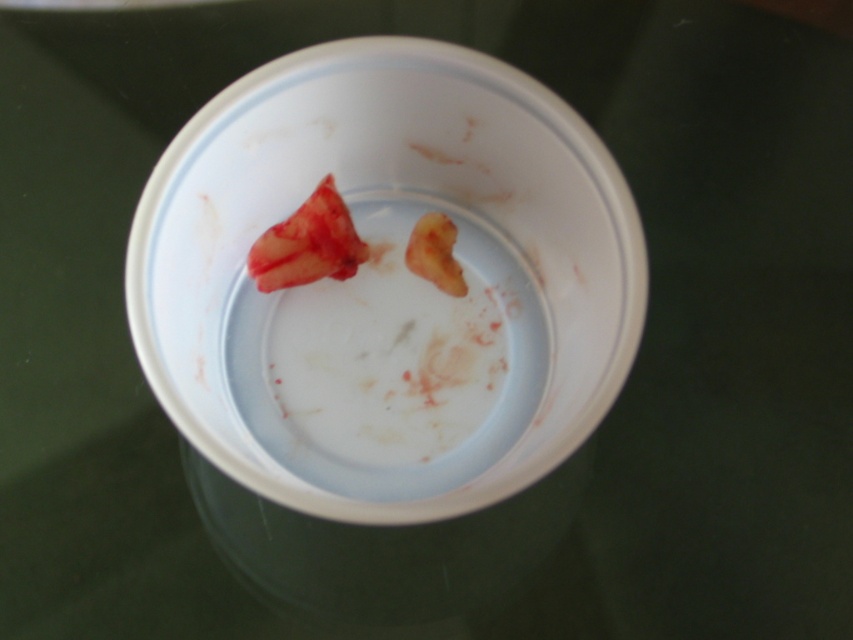
Is white glossy plate at center above meaty red at center?

Actually, white glossy plate at center is below meaty red at center.

Is white glossy plate at center further to the viewer compared to meaty red at center?

No, it is in front of meaty red at center.

Is point (476, 56) more distant than point (271, 282)?

No, it is not.

Locate an element on the screen. white glossy plate at center is located at coordinates (380, 228).

Is point (328, 192) less distant than point (416, 227)?

Yes, point (328, 192) is closer to viewer.

Is meaty red at center further to the viewer compared to yellowish matte flesh at center?

No, it is in front of yellowish matte flesh at center.

Which is behind, point (315, 224) or point (460, 275)?

Point (460, 275)

Where is `meaty red at center`? meaty red at center is located at coordinates (308, 243).

Based on the photo, can you confirm if white glossy plate at center is positioned above yellowish matte flesh at center?

Actually, white glossy plate at center is below yellowish matte flesh at center.

Image resolution: width=853 pixels, height=640 pixels. Describe the element at coordinates (380, 228) in the screenshot. I see `white glossy plate at center` at that location.

At what (x,y) coordinates should I click in order to perform the action: click on white glossy plate at center. Please return your answer as a coordinate pair (x, y). The image size is (853, 640). Looking at the image, I should click on (380, 228).